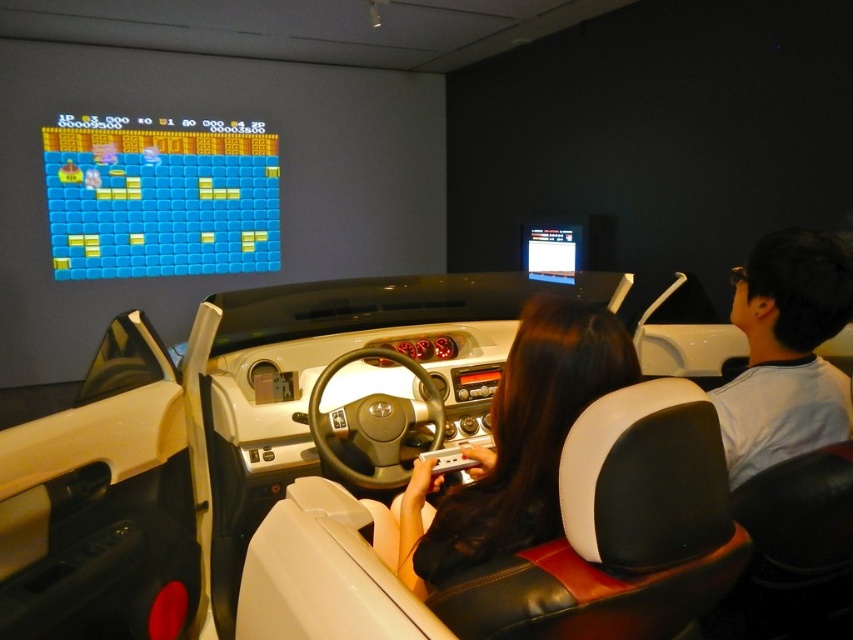
You are a game developer designing a new racing game. You want to ensure that the driver can comfortably reach the steering wheel while sitting on the black leather car seat at center. The driver has hair that reaches down to the black leather hair at center. Is the distance between the driver and the car seat sufficient for the driver to comfortably reach the steering wheel?

The distance between the black leather hair at center and the black leather car seat at center is 20.66 inches. This suggests that the driver has enough space to comfortably reach the steering wheel while seated on the black leather car seat at center.

You are a game developer designing a new racing game. You want to ensure that players can easily reach the steering wheel while sitting in the car seat. Based on the scene, is the black leather hair at center closer to the steering wheel than the black leather car seat at center?

The black leather hair at center is positioned on the left side of the black leather car seat at center, so it is not closer to the steering wheel. The black leather car seat at center is where the player sits, so the steering wheel should be within reach from there.